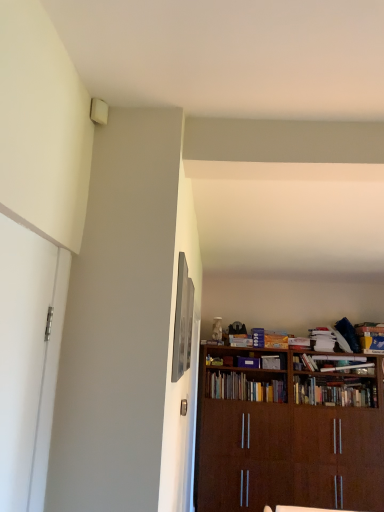
Question: From a real-world perspective, does brown wooden bookcase at lower right sit lower than matte silver picture frame at upper center?

Choices:
 (A) yes
 (B) no

Answer: (A)

Question: Does brown wooden bookcase at lower right turn towards matte silver picture frame at upper center?

Choices:
 (A) yes
 (B) no

Answer: (A)

Question: Does brown wooden bookcase at lower right have a larger size compared to matte silver picture frame at upper center?

Choices:
 (A) yes
 (B) no

Answer: (A)

Question: Is brown wooden bookcase at lower right facing away from matte silver picture frame at upper center?

Choices:
 (A) no
 (B) yes

Answer: (A)

Question: Is brown wooden bookcase at lower right far away from matte silver picture frame at upper center?

Choices:
 (A) yes
 (B) no

Answer: (A)

Question: Is matte silver picture frame at upper center wider or thinner than hardcover book at center, which is counted as the third book, starting from the left?

Choices:
 (A) wide
 (B) thin

Answer: (B)

Question: In the image, is matte silver picture frame at upper center positioned in front of or behind hardcover book at center, which is counted as the third book, starting from the left?

Choices:
 (A) behind
 (B) front

Answer: (B)

Question: Looking at the image, does matte silver picture frame at upper center seem bigger or smaller compared to hardcover book at center, which is counted as the third book, starting from the left?

Choices:
 (A) big
 (B) small

Answer: (B)

Question: From the image's perspective, is matte silver picture frame at upper center above or below hardcover book at center, positioned as the second book in right-to-left order?

Choices:
 (A) below
 (B) above

Answer: (B)

Question: From a real-world perspective, is hardcover books at center, the first book when ordered from left to right, above or below matte silver picture frame at upper center?

Choices:
 (A) below
 (B) above

Answer: (A)

Question: Is point (231, 394) closer or farther from the camera than point (185, 338)?

Choices:
 (A) closer
 (B) farther

Answer: (B)

Question: Based on their positions, is hardcover books at center, which appears as the fourth book when viewed from the right, located to the left or right of matte silver picture frame at upper center?

Choices:
 (A) left
 (B) right

Answer: (B)

Question: In the image, is hardcover books at center, which appears as the fourth book when viewed from the right, positioned in front of or behind matte silver picture frame at upper center?

Choices:
 (A) front
 (B) behind

Answer: (B)

Question: From their relative heights in the image, would you say blue cardboard book at right, which is the 1th book in right-to-left order, is taller or shorter than hardcover books at center, which appears as the fourth book when viewed from the right?

Choices:
 (A) tall
 (B) short

Answer: (A)

Question: From a real-world perspective, is blue cardboard book at right, arranged as the fourth book when viewed from the left, physically located above or below hardcover books at center, the first book when ordered from left to right?

Choices:
 (A) below
 (B) above

Answer: (B)